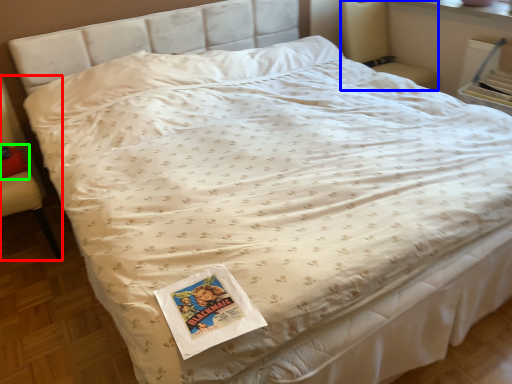
Question: Which object is the closest to the armchair (highlighted by a red box)? Choose among these: armchair (highlighted by a blue box) or pillow (highlighted by a green box).

Choices:
 (A) armchair
 (B) pillow

Answer: (B)